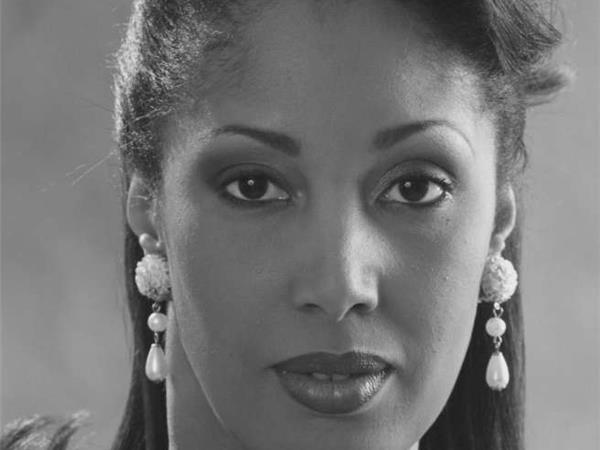
Where is `walls`? walls is located at coordinates (554, 203), (46, 212).